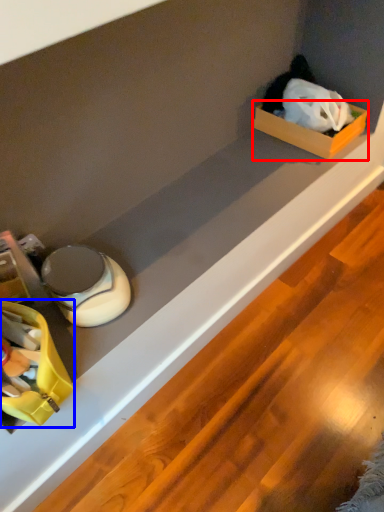
Question: Which point is further to the camera, box (highlighted by a red box) or storage box (highlighted by a blue box)?

Choices:
 (A) box
 (B) storage box

Answer: (A)